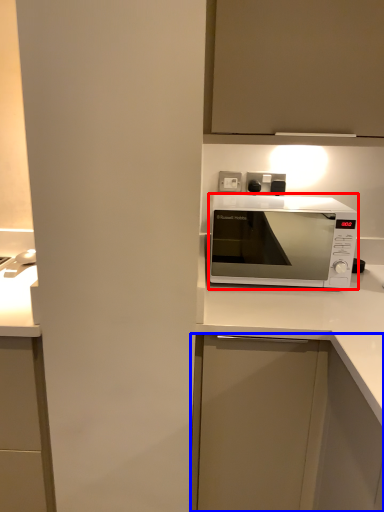
Question: Which object appears closest to the camera in this image, microwave oven (highlighted by a red box) or cabinetry (highlighted by a blue box)?

Choices:
 (A) microwave oven
 (B) cabinetry

Answer: (B)